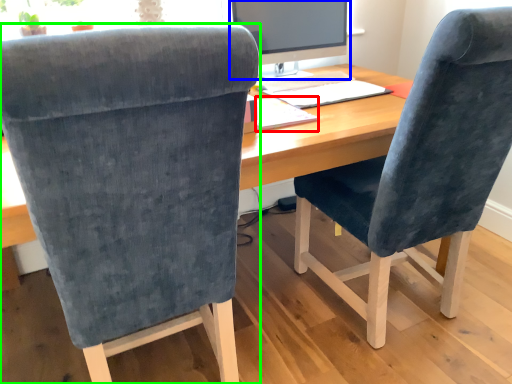
Question: Which is nearer to the notepad (highlighted by a red box)? computer monitor (highlighted by a blue box) or chair (highlighted by a green box).

Choices:
 (A) computer monitor
 (B) chair

Answer: (A)